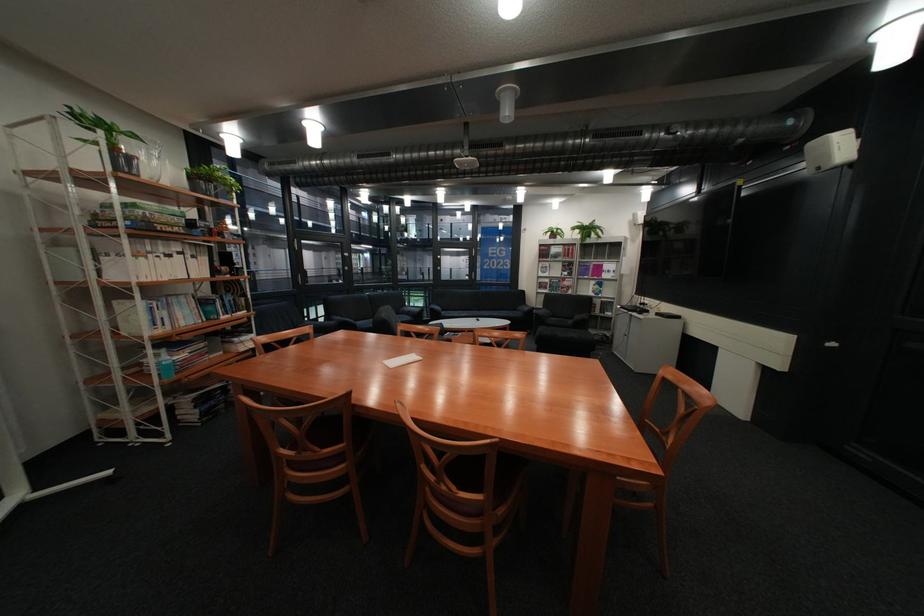
Find where to lift the blue sanitizer bottle. Please return your answer as a coordinate pair (x, y).

(164, 363)